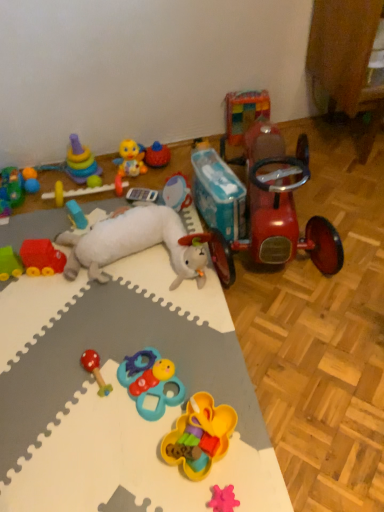
Question: From the image's perspective, is shiny red tricycle at right, which is the 13th toy from left to right, on top of rubber car at left, placed as the 1th toy when sorted from left to right?

Choices:
 (A) yes
 (B) no

Answer: (A)

Question: Can you confirm if shiny red tricycle at right, which is the 13th toy from left to right, is shorter than rubber car at left, which is the thirteenth toy in right-to-left order?

Choices:
 (A) no
 (B) yes

Answer: (A)

Question: Is shiny red tricycle at right, which is the 13th toy from left to right, to the left of rubber car at left, which is the thirteenth toy in right-to-left order, from the viewer's perspective?

Choices:
 (A) no
 (B) yes

Answer: (A)

Question: Is shiny red tricycle at right, which is counted as the 1th toy, starting from the right, placed right next to rubber car at left, which is the thirteenth toy in right-to-left order?

Choices:
 (A) yes
 (B) no

Answer: (B)

Question: Is shiny red tricycle at right, which is the 13th toy from left to right, far from rubber car at left, placed as the 1th toy when sorted from left to right?

Choices:
 (A) yes
 (B) no

Answer: (A)

Question: Is the position of shiny red tricycle at right, which is counted as the 1th toy, starting from the right, more distant than that of rubber car at left, placed as the 1th toy when sorted from left to right?

Choices:
 (A) yes
 (B) no

Answer: (B)

Question: Does rubberized yellow flower-shaped toy at center, the 4th toy from the right, have a larger size compared to multicolored plastic rings at upper left, marked as the 2th toy in a left-to-right arrangement?

Choices:
 (A) no
 (B) yes

Answer: (A)

Question: Does rubberized yellow flower-shaped toy at center, the tenth toy in the left-to-right sequence, lie behind multicolored plastic rings at upper left, marked as the 2th toy in a left-to-right arrangement?

Choices:
 (A) yes
 (B) no

Answer: (B)

Question: Is rubberized yellow flower-shaped toy at center, the 4th toy from the right, far from multicolored plastic rings at upper left, marked as the 2th toy in a left-to-right arrangement?

Choices:
 (A) yes
 (B) no

Answer: (A)

Question: Is rubberized yellow flower-shaped toy at center, the tenth toy in the left-to-right sequence, thinner than multicolored plastic rings at upper left, marked as the 2th toy in a left-to-right arrangement?

Choices:
 (A) no
 (B) yes

Answer: (A)

Question: Is rubberized yellow flower-shaped toy at center, the tenth toy in the left-to-right sequence, oriented towards multicolored plastic rings at upper left, the 12th toy from the right?

Choices:
 (A) no
 (B) yes

Answer: (A)

Question: Is rubberized yellow flower-shaped toy at center, the 4th toy from the right, outside of multicolored plastic rings at upper left, the 12th toy from the right?

Choices:
 (A) no
 (B) yes

Answer: (B)

Question: Is rubberized yellow flower-shaped toy at center, the tenth toy in the left-to-right sequence, closer to the viewer compared to yellow rubber duck at upper center, arranged as the sixth toy when viewed from the left?

Choices:
 (A) yes
 (B) no

Answer: (A)